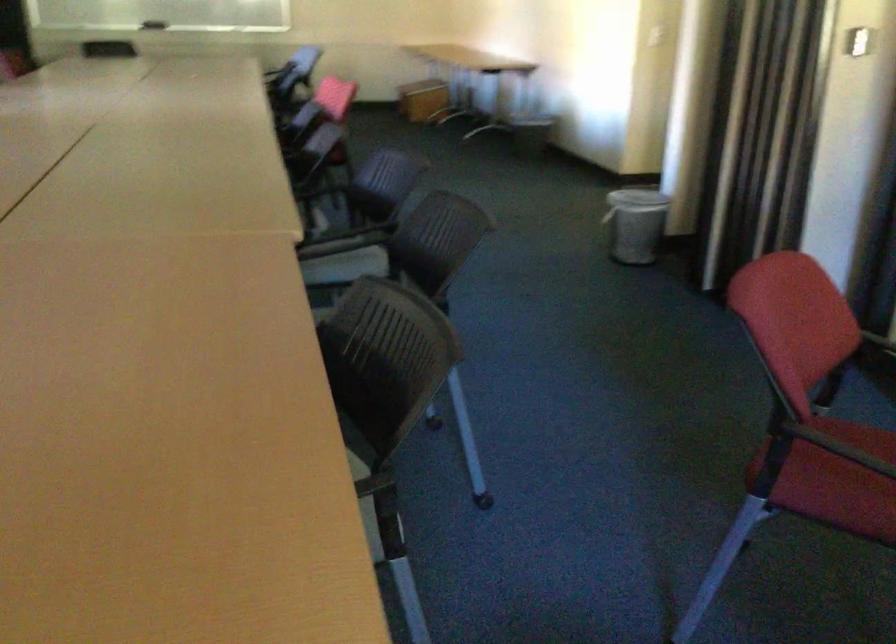
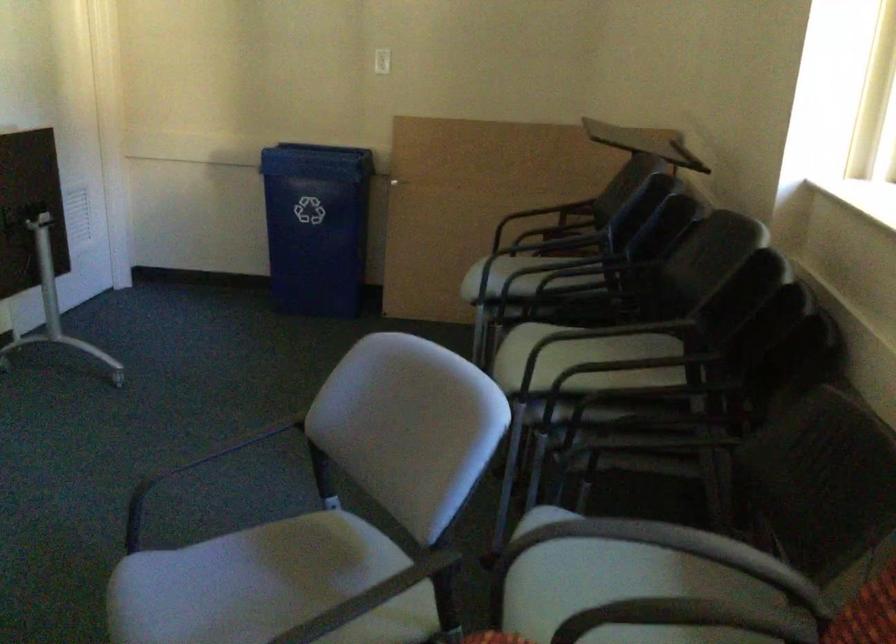
Question: The first image is from the beginning of the video and the second image is from the end. How did the camera likely rotate when shooting the video?

Choices:
 (A) Left
 (B) Right
 (C) Up
 (D) Down

Answer: (B)